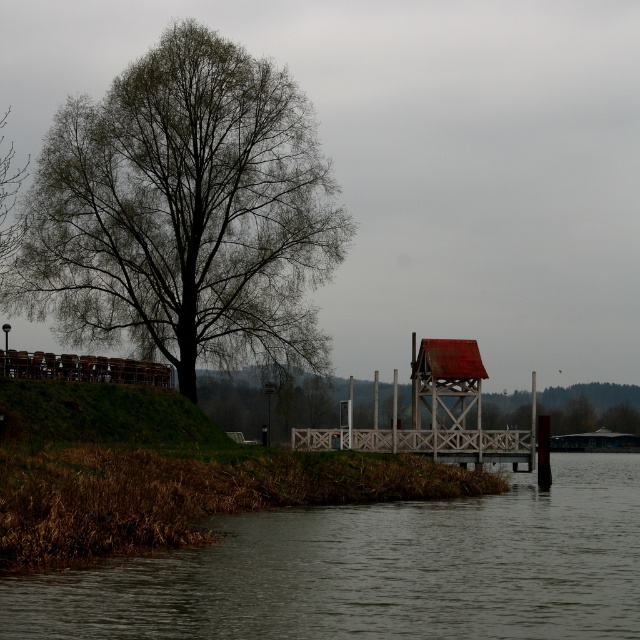
Question: Can you confirm if green leafy tree at left is positioned to the left of brown matte river at lower left?

Choices:
 (A) no
 (B) yes

Answer: (B)

Question: Which point is closer to the camera?

Choices:
 (A) green leafy tree at left
 (B) brown matte river at lower left

Answer: (B)

Question: Does green leafy tree at left appear under brown matte river at lower left?

Choices:
 (A) no
 (B) yes

Answer: (A)

Question: Observing the image, what is the correct spatial positioning of green leafy tree at left in reference to brown matte river at lower left?

Choices:
 (A) below
 (B) above

Answer: (B)

Question: Which object is closer to the camera taking this photo?

Choices:
 (A) green leafy tree at left
 (B) brown matte river at lower left

Answer: (B)

Question: Among these objects, which one is nearest to the camera?

Choices:
 (A) brown matte river at lower left
 (B) green leafy tree at left

Answer: (A)